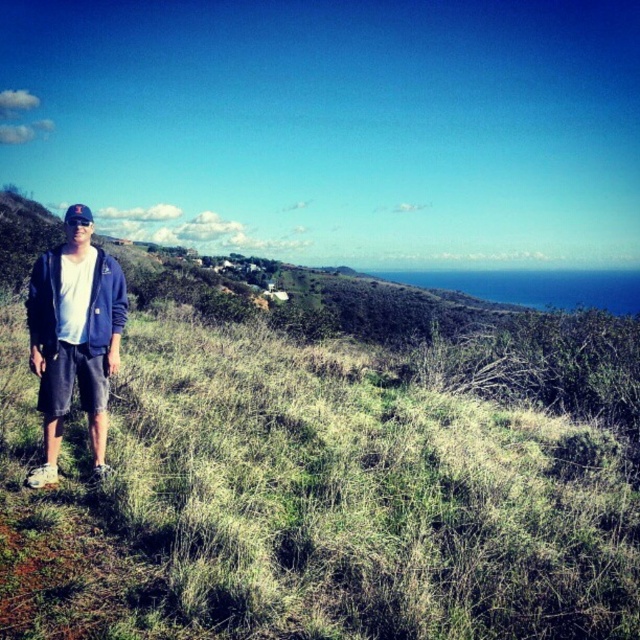
Does matte blue jacket at left have a smaller size compared to blue fabric baseball cap at left?

Correct, matte blue jacket at left occupies less space than blue fabric baseball cap at left.

Is matte blue jacket at left above blue fabric baseball cap at left?

Actually, matte blue jacket at left is below blue fabric baseball cap at left.

This screenshot has height=640, width=640. What are the coordinates of `matte blue jacket at left` in the screenshot? It's located at (74, 339).

From the picture: Can you confirm if green grassy at center is positioned below matte blue jacket at left?

Yes, green grassy at center is below matte blue jacket at left.

Who is more forward, (564,632) or (60,326)?

Point (564,632) is in front.

Is point (150, 632) positioned in front of point (54, 248)?

Yes, point (150, 632) is in front of point (54, 248).

You are a GUI agent. You are given a task and a screenshot of the screen. Output one action in this format:
    pyautogui.click(x=<x>, y=<y>)
    Task: Click on the green grassy at center
    The image size is (640, 640).
    Given the screenshot: What is the action you would take?
    pyautogui.click(x=314, y=502)

Who is taller, green grassy at center or blue fabric baseball cap at left?

blue fabric baseball cap at left

Can you confirm if green grassy at center is positioned above blue fabric baseball cap at left?

Actually, green grassy at center is below blue fabric baseball cap at left.

Is point (381, 378) positioned in front of point (68, 216)?

That is False.

Where is `green grassy at center`? The image size is (640, 640). green grassy at center is located at coordinates (314, 502).